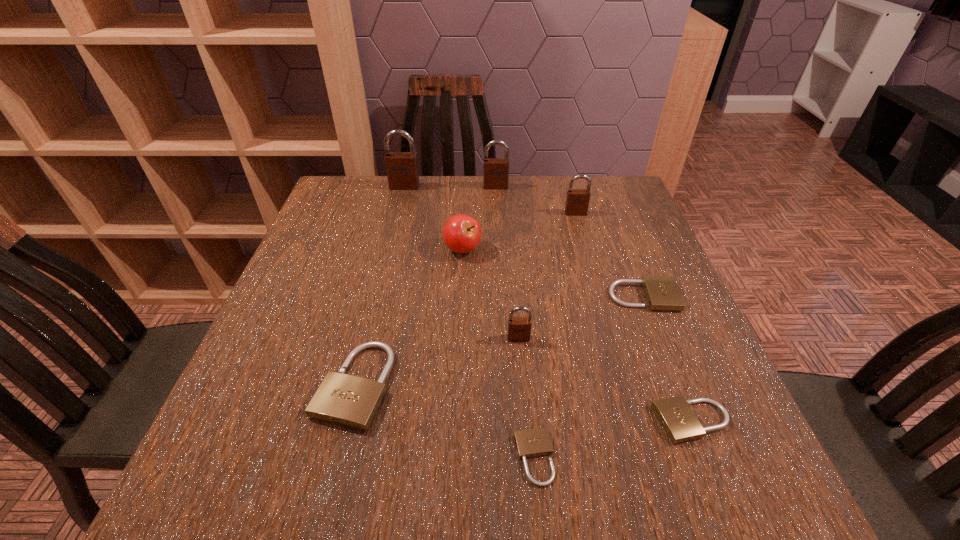
Find the location of a particular element. vacant region located 0.220m on the front-facing side of the second nearest brown padlock is located at coordinates (591, 267).

Locate an element on the screen. vacant area situated on the right of the fourth farthest object is located at coordinates click(x=538, y=249).

Find the location of a particular element. vacant area situated 0.220m on the front-facing side of the fifth shortest padlock is located at coordinates (528, 446).

Find the location of a particular element. The height and width of the screenshot is (540, 960). blank area located 0.290m on the back of the leftmost beige padlock is located at coordinates (387, 254).

Find the location of a particular element. This screenshot has width=960, height=540. free location located 0.380m on the left of the fifth nearest object is located at coordinates (439, 296).

The height and width of the screenshot is (540, 960). In order to click on blank space located 0.120m on the back of the second shortest padlock in this screenshot , I will do `click(663, 347)`.

This screenshot has width=960, height=540. I want to click on vacant area situated 0.330m on the left of the smallest beige padlock, so click(x=310, y=458).

Where is `object positioned at the near edge`? The width and height of the screenshot is (960, 540). object positioned at the near edge is located at coordinates (535, 442).

You are a GUI agent. You are given a task and a screenshot of the screen. Output one action in this format:
    pyautogui.click(x=<x>, y=<y>)
    Task: Click on the object that is at the left edge
    
    Given the screenshot: What is the action you would take?
    pyautogui.click(x=349, y=401)

Where is `object situated at the far right corner`? object situated at the far right corner is located at coordinates (577, 201).